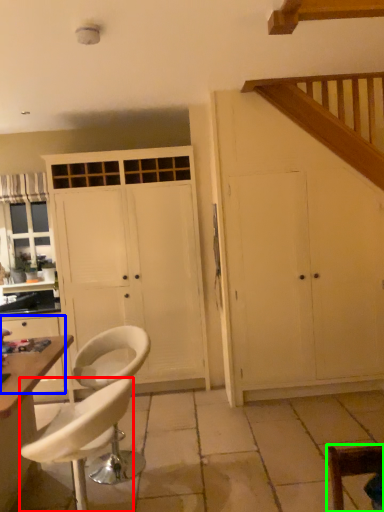
Question: Based on their relative distances, which object is farther from chair (highlighted by a red box)? Choose from cabinetry (highlighted by a blue box) and chair (highlighted by a green box).

Choices:
 (A) cabinetry
 (B) chair

Answer: (A)